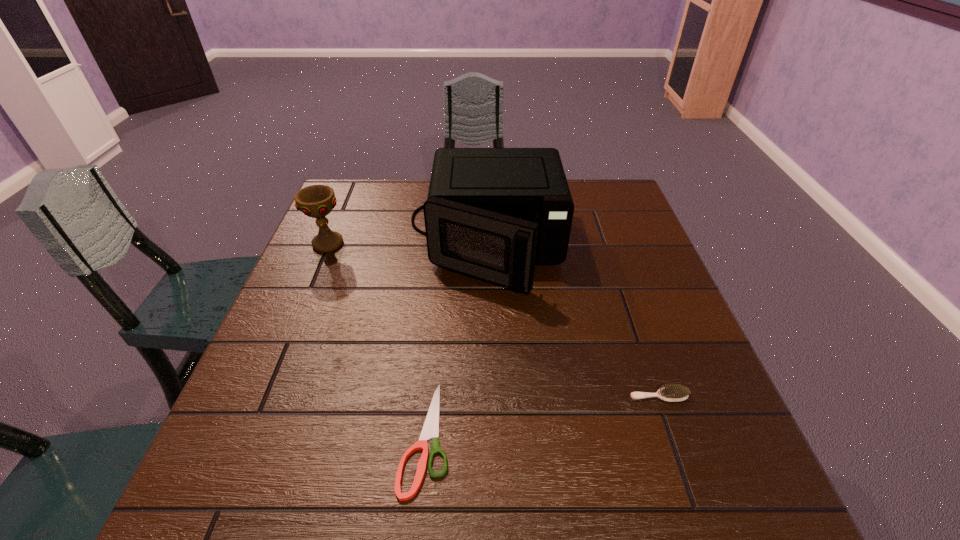
I want to click on microwave oven, so click(x=490, y=213).

Locate an element on the screen. the leftmost object is located at coordinates (316, 201).

This screenshot has width=960, height=540. What are the coordinates of `the third shortest object` in the screenshot? It's located at (316, 201).

Locate an element on the screen. the rightmost object is located at coordinates (673, 393).

The image size is (960, 540). Identify the location of scrubbing brush. (673, 393).

I want to click on scissors, so click(x=430, y=429).

Where is `vacant space situated 0.140m with the door open on the microwave oven`? The height and width of the screenshot is (540, 960). vacant space situated 0.140m with the door open on the microwave oven is located at coordinates (489, 350).

You are a GUI agent. You are given a task and a screenshot of the screen. Output one action in this format:
    pyautogui.click(x=<x>, y=<y>)
    Task: Click on the free space located 0.350m on the front of the leftmost object
    
    Given the screenshot: What is the action you would take?
    pyautogui.click(x=279, y=362)

Locate an element on the screen. free spot located 0.070m on the left of the scrubbing brush is located at coordinates (593, 396).

You are a GUI agent. You are given a task and a screenshot of the screen. Output one action in this format:
    pyautogui.click(x=<x>, y=<y>)
    Task: Click on the free space located on the right of the shortest object
    This screenshot has height=540, width=960.
    Given the screenshot: What is the action you would take?
    pyautogui.click(x=522, y=437)